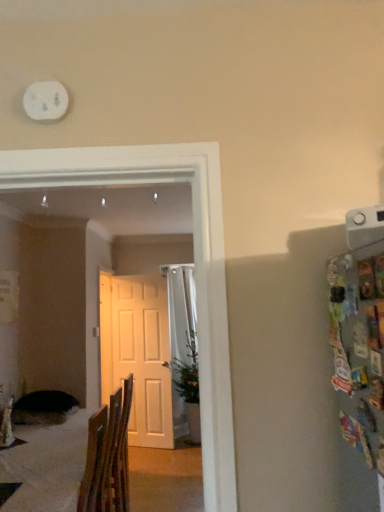
Question: Is wooden chair at lower left surrounded by green leafy plant at center?

Choices:
 (A) yes
 (B) no

Answer: (B)

Question: From a real-world perspective, is green leafy plant at center on top of wooden chair at lower left?

Choices:
 (A) no
 (B) yes

Answer: (B)

Question: Would you say green leafy plant at center is outside wooden chair at lower left?

Choices:
 (A) no
 (B) yes

Answer: (B)

Question: From a real-world perspective, is green leafy plant at center under wooden chair at lower left?

Choices:
 (A) yes
 (B) no

Answer: (B)

Question: Is green leafy plant at center positioned with its back to wooden chair at lower left?

Choices:
 (A) no
 (B) yes

Answer: (A)

Question: In terms of height, does white matte door at center look taller or shorter compared to green leafy plant at center?

Choices:
 (A) short
 (B) tall

Answer: (B)

Question: Is white matte door at center bigger or smaller than green leafy plant at center?

Choices:
 (A) big
 (B) small

Answer: (B)

Question: Is white matte door at center inside or outside of green leafy plant at center?

Choices:
 (A) outside
 (B) inside

Answer: (A)

Question: From the image's perspective, is white matte door at center positioned above or below green leafy plant at center?

Choices:
 (A) below
 (B) above

Answer: (B)

Question: Visually, is white matte clock at upper left positioned to the left or to the right of white matte door at center?

Choices:
 (A) left
 (B) right

Answer: (B)

Question: Which is correct: white matte clock at upper left is inside white matte door at center, or outside of it?

Choices:
 (A) outside
 (B) inside

Answer: (A)

Question: Considering the positions of white matte clock at upper left and white matte door at center in the image, is white matte clock at upper left bigger or smaller than white matte door at center?

Choices:
 (A) small
 (B) big

Answer: (A)

Question: From a real-world perspective, relative to white matte door at center, is white matte clock at upper left vertically above or below?

Choices:
 (A) above
 (B) below

Answer: (A)

Question: Is point (165, 382) positioned closer to the camera than point (34, 99)?

Choices:
 (A) closer
 (B) farther

Answer: (B)

Question: Is white matte door at center wider or thinner than white matte clock at upper left?

Choices:
 (A) thin
 (B) wide

Answer: (B)